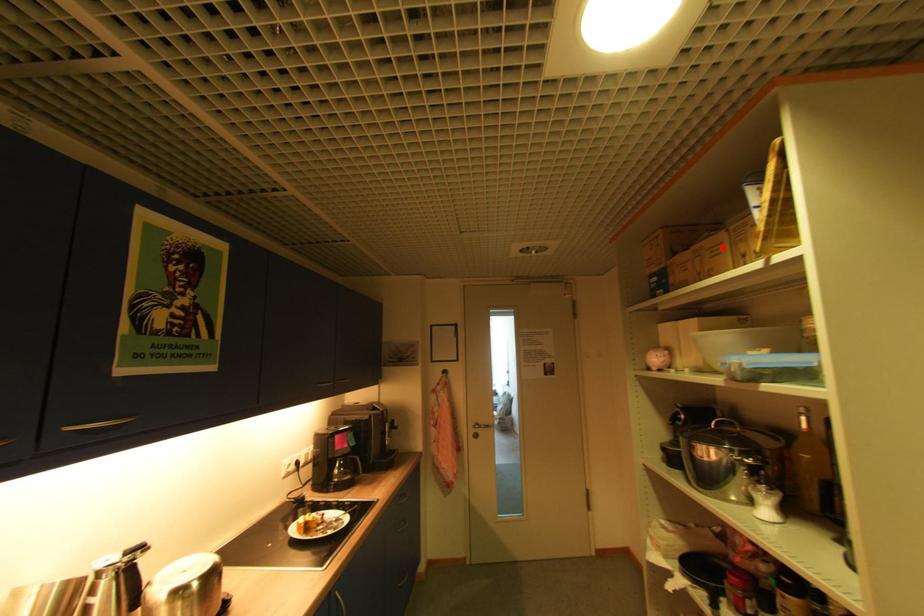
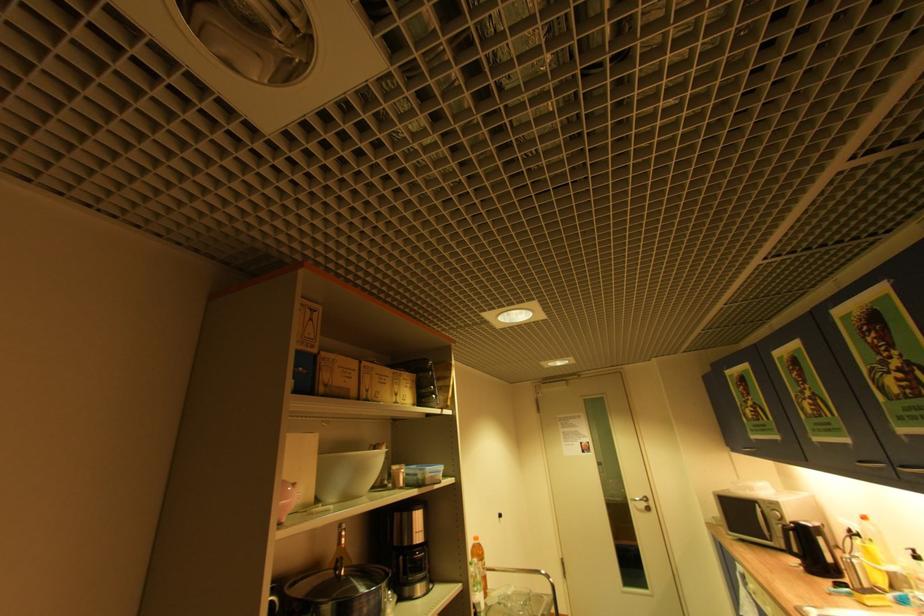
Question: I am providing you with two images of the same scene from different viewpoints. A red point is marked on the first image. At the location where the point appears in image 1, is it still visible in image 2?

Choices:
 (A) Yes
 (B) No

Answer: (A)